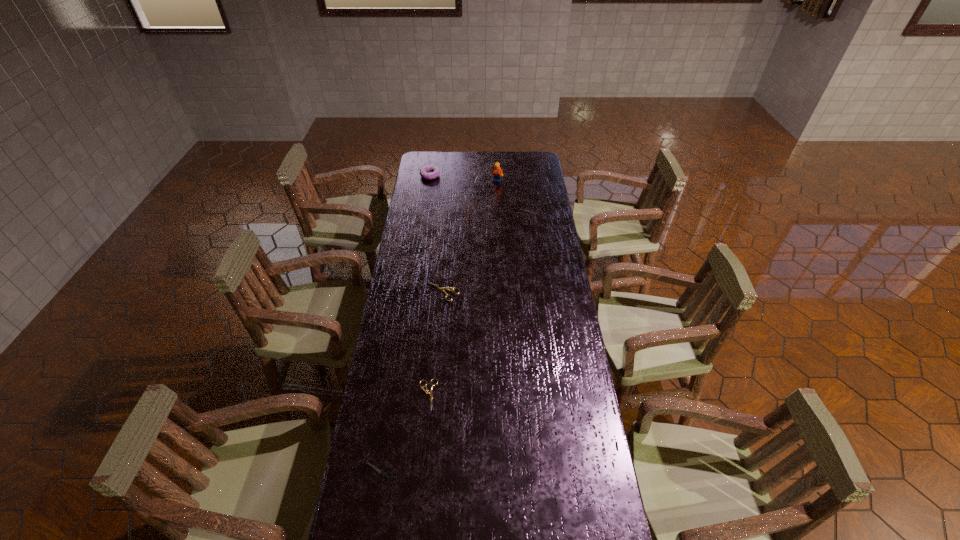
Identify the location of vacant space that satisfies the following two spatial constraints: 1. on the front-facing side of the orange Lego; 2. on the right side of the rightmost shears. (498, 210).

What are the coordinates of `vacant position in the image that satisfies the following two spatial constraints: 1. on the front-facing side of the second object from right to left; 2. on the face of the sunglasses` in the screenshot? It's located at (498, 214).